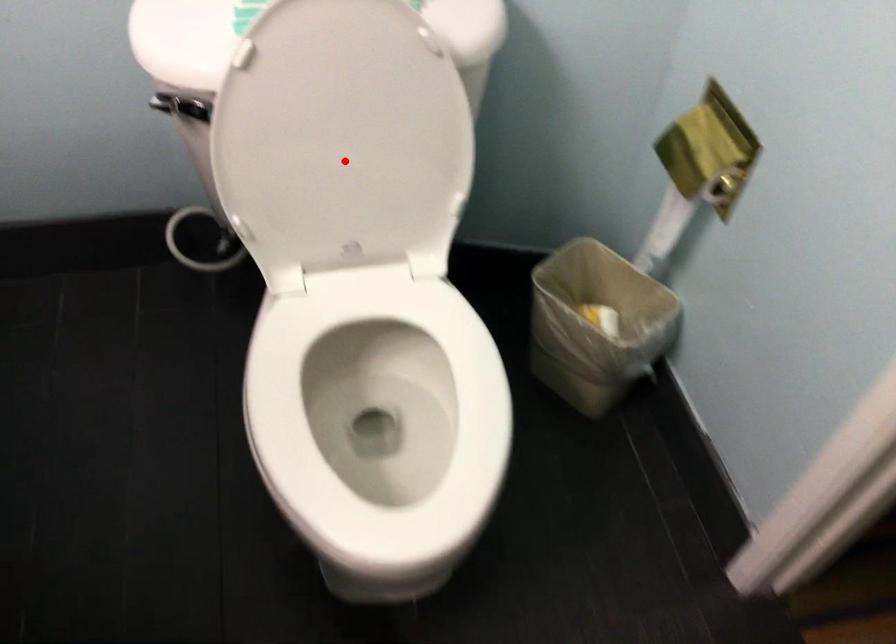
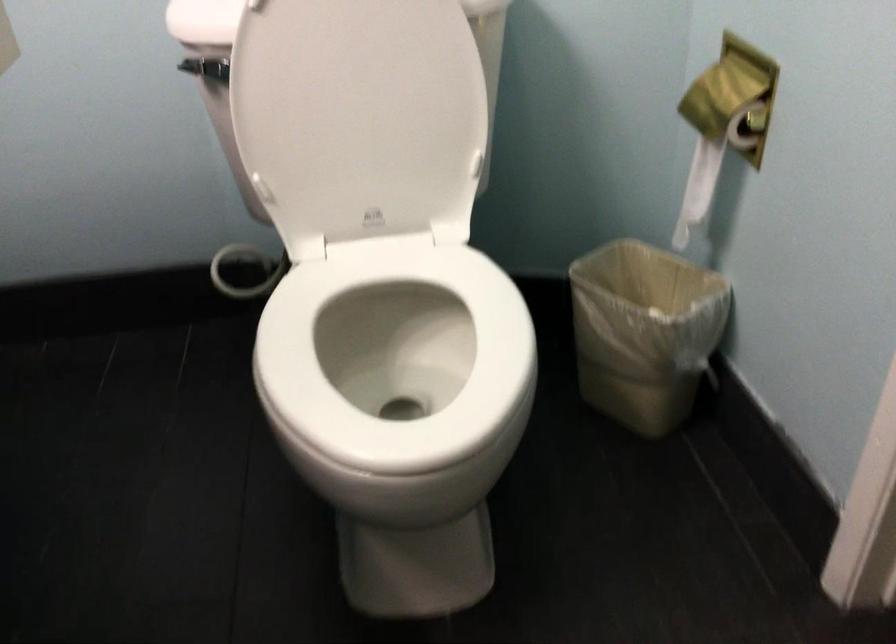
In the second image, find the point that corresponds to the highlighted location in the first image.

(359, 114)